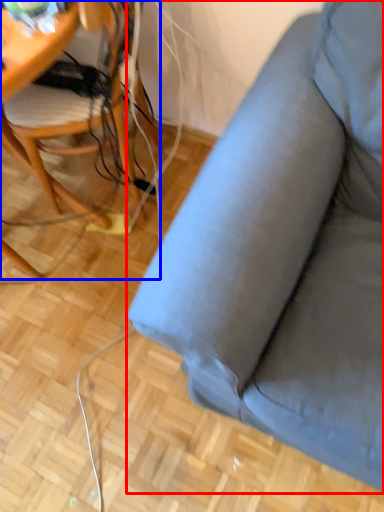
Question: Which object is closer to the camera taking this photo, studio couch (highlighted by a red box) or chair (highlighted by a blue box)?

Choices:
 (A) studio couch
 (B) chair

Answer: (A)